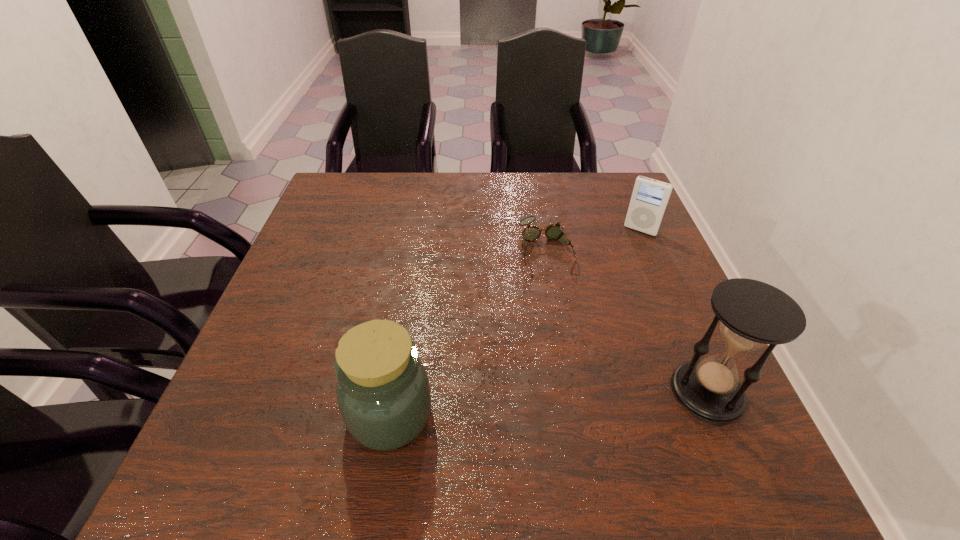
The image size is (960, 540). I want to click on the second tallest object, so click(383, 393).

The image size is (960, 540). I want to click on the leftmost object, so click(383, 393).

Locate an element on the screen. The height and width of the screenshot is (540, 960). hourglass is located at coordinates (752, 313).

The image size is (960, 540). What are the coordinates of `the shortest object` in the screenshot? It's located at (554, 231).

Where is `spectacles`? Image resolution: width=960 pixels, height=540 pixels. spectacles is located at coordinates (554, 231).

Identify the location of iPod. The height and width of the screenshot is (540, 960). (650, 197).

Where is `vacant space located on the back of the jar`? vacant space located on the back of the jar is located at coordinates (401, 345).

In order to click on free space located 0.390m on the left of the tallest object in this screenshot , I will do `click(464, 392)`.

You are a GUI agent. You are given a task and a screenshot of the screen. Output one action in this format:
    pyautogui.click(x=<x>, y=<y>)
    Task: Click on the vacant space situated on the front-facing side of the spectacles
    
    Given the screenshot: What is the action you would take?
    pyautogui.click(x=563, y=313)

This screenshot has height=540, width=960. I want to click on free space located on the front-facing side of the spectacles, so click(570, 342).